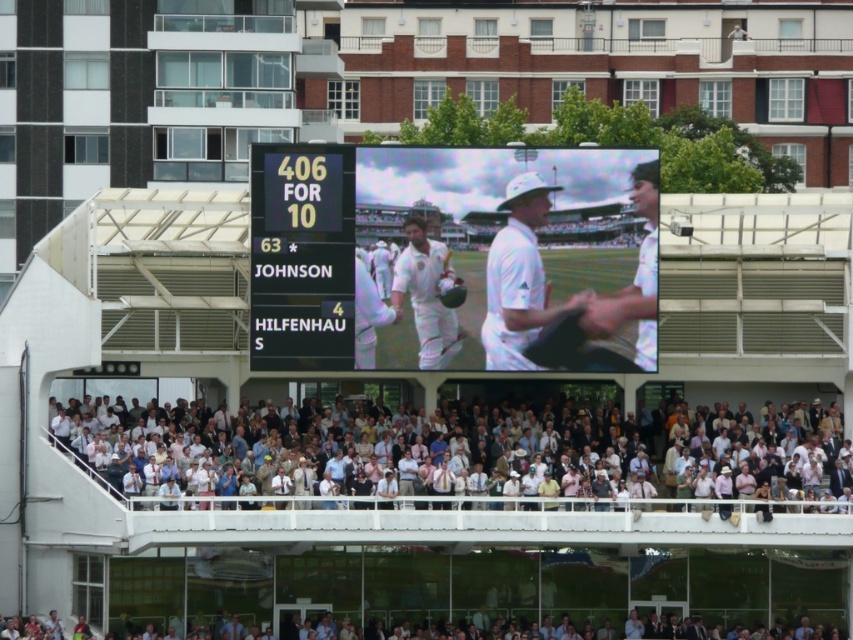
Is white cotton crowd at lower center positioned in front of white clothed man at center?

Yes, it is.

Is white cotton crowd at lower center taller than white clothed man at center?

Indeed, white cotton crowd at lower center has a greater height compared to white clothed man at center.

Identify the location of white cotton crowd at lower center. The height and width of the screenshot is (640, 853). (520, 461).

You are a GUI agent. You are given a task and a screenshot of the screen. Output one action in this format:
    pyautogui.click(x=<x>, y=<y>)
    Task: Click on the white cotton crowd at lower center
    This screenshot has width=853, height=640.
    Given the screenshot: What is the action you would take?
    pyautogui.click(x=520, y=461)

Is white cotton crowd at lower center below yellow digital scoreboard at center?

Yes.

Does point (646, 460) lie behind point (256, 193)?

That is True.

Find the location of a particular element. This screenshot has width=853, height=640. white cotton crowd at lower center is located at coordinates (520, 461).

Who is positioned more to the right, white cotton crowd at lower center or white matte cricket helmet at center?

white cotton crowd at lower center

Does white cotton crowd at lower center have a greater width compared to white matte cricket helmet at center?

Result: Yes, white cotton crowd at lower center is wider than white matte cricket helmet at center.

Which is in front, point (682, 468) or point (409, 220)?

Positioned in front is point (409, 220).

The width and height of the screenshot is (853, 640). In order to click on white cotton crowd at lower center in this screenshot , I will do `click(520, 461)`.